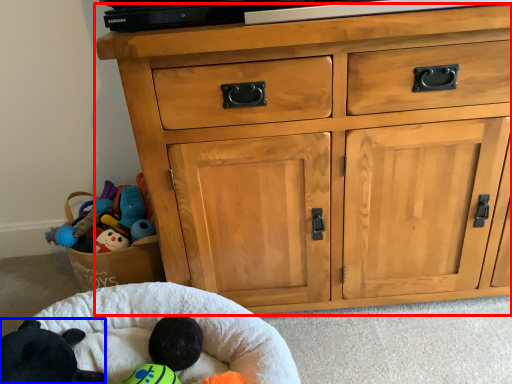
Question: Which object is further to the camera taking this photo, chest of drawers (highlighted by a red box) or animal (highlighted by a blue box)?

Choices:
 (A) chest of drawers
 (B) animal

Answer: (A)